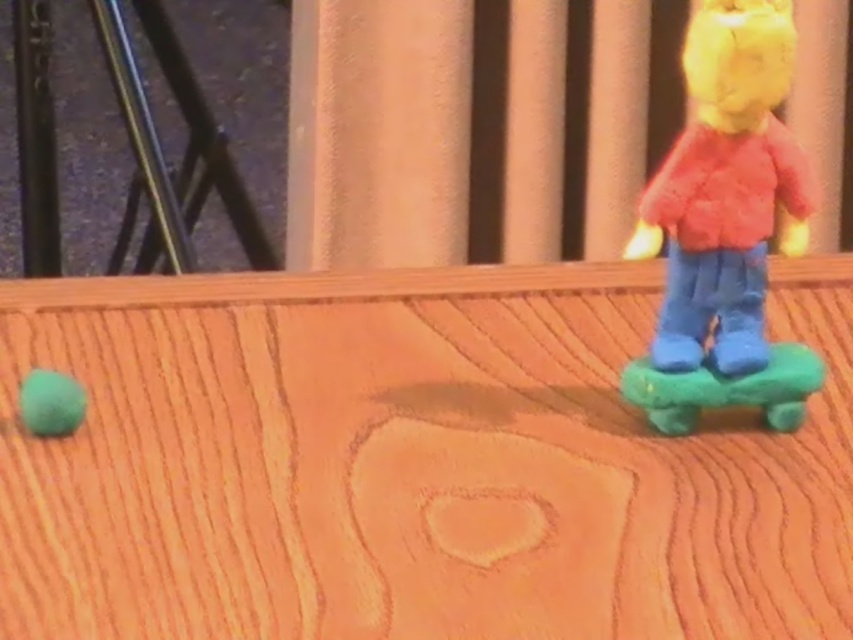
Question: Is matte plastic toy at right to the left of green rubber skateboard at right from the viewer's perspective?

Choices:
 (A) no
 (B) yes

Answer: (B)

Question: Can you confirm if green rubber skateboard at right is thinner than matte green ball at left?

Choices:
 (A) yes
 (B) no

Answer: (B)

Question: Which point is farther to the camera?

Choices:
 (A) (680, 380)
 (B) (61, 417)

Answer: (A)

Question: Which point is closer to the camera?

Choices:
 (A) green rubber skateboard at right
 (B) matte plastic toy at right

Answer: (B)

Question: Does green rubber skateboard at right have a lesser width compared to matte green ball at left?

Choices:
 (A) no
 (B) yes

Answer: (A)

Question: Among these objects, which one is farthest from the camera?

Choices:
 (A) matte plastic toy at right
 (B) green rubber skateboard at right
 (C) matte green ball at left

Answer: (B)